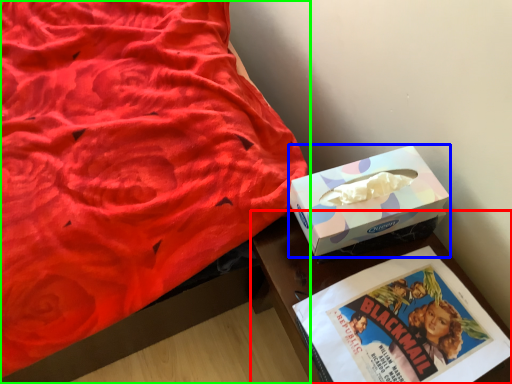
Question: Which is nearer to the table (highlighted by a red box)? box (highlighted by a blue box) or bed (highlighted by a green box).

Choices:
 (A) box
 (B) bed

Answer: (A)